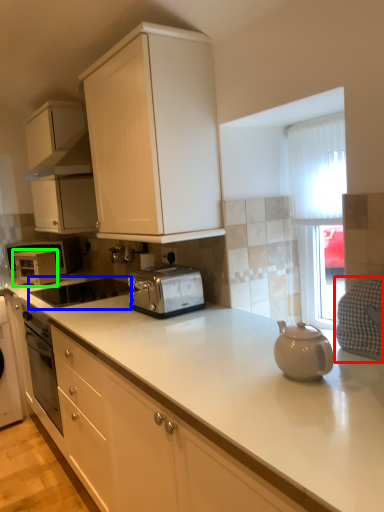
Question: Which object is the farthest from gray (highlighted by a red box)? Choose among these: appliance (highlighted by a blue box) or appliance (highlighted by a green box).

Choices:
 (A) appliance
 (B) appliance

Answer: (B)